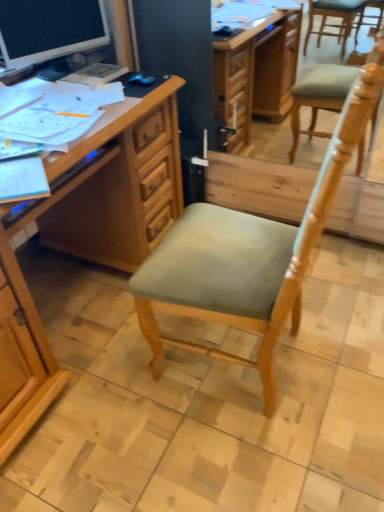
Where is `wooden desk at left`? wooden desk at left is located at coordinates (87, 233).

Locate an element on the screen. The height and width of the screenshot is (512, 384). light green fabric chair at center is located at coordinates (246, 257).

Identify the location of matte black monitor at upper left. (49, 29).

Does wooden desk at left have a larger size compared to light green fabric chair at center?

Indeed, wooden desk at left has a larger size compared to light green fabric chair at center.

Is light green fabric chair at center located within wooden desk at left?

Definitely not — light green fabric chair at center is not inside wooden desk at left.

Considering the sizes of objects wooden desk at left and light green fabric chair at center in the image provided, who is wider, wooden desk at left or light green fabric chair at center?

wooden desk at left is wider.

Considering the points (26, 321) and (168, 341), which point is behind, point (26, 321) or point (168, 341)?

Positioned behind is point (168, 341).

Would you say matte black monitor at upper left is inside or outside wooden desk at left?

matte black monitor at upper left is not enclosed by wooden desk at left.

Would you say matte black monitor at upper left is a long distance from wooden desk at left?

Actually, matte black monitor at upper left and wooden desk at left are a little close together.

From the image's perspective, which is below, light green fabric chair at center or matte black monitor at upper left?

light green fabric chair at center is shown below in the image.

Is light green fabric chair at center positioned far away from matte black monitor at upper left?

Yes, light green fabric chair at center and matte black monitor at upper left are quite far apart.

Which is closer to the camera, (143,308) or (60,25)?

The point (143,308) is more forward.

Can you confirm if light green fabric chair at center is shorter than matte black monitor at upper left?

In fact, light green fabric chair at center may be taller than matte black monitor at upper left.

Is wooden desk at left situated inside matte black monitor at upper left or outside?

wooden desk at left exists outside the volume of matte black monitor at upper left.

Which is behind, wooden desk at left or matte black monitor at upper left?

matte black monitor at upper left is more distant.

Considering the relative sizes of wooden desk at left and matte black monitor at upper left in the image provided, is wooden desk at left thinner than matte black monitor at upper left?

No.

This screenshot has height=512, width=384. Identify the location of desk that is below the matte black monitor at upper left (from the image's perspective). (87, 233).

Is the depth of matte black monitor at upper left less than that of light green fabric chair at center?

No, it is not.

From the image's perspective, is matte black monitor at upper left above or below light green fabric chair at center?

From the image's perspective, matte black monitor at upper left appears above light green fabric chair at center.

Does matte black monitor at upper left have a lesser height compared to light green fabric chair at center?

Yes.

Would you say light green fabric chair at center is a long distance from wooden desk at left?

No, light green fabric chair at center is not far from wooden desk at left.

Which is more to the left, light green fabric chair at center or wooden desk at left?

wooden desk at left is more to the left.

Relative to wooden desk at left, is light green fabric chair at center in front or behind?

Visually, light green fabric chair at center is located in front of wooden desk at left.

Consider the image. Who is shorter, light green fabric chair at center or wooden desk at left?

wooden desk at left.

Image resolution: width=384 pixels, height=512 pixels. I want to click on chair that is on the right side of wooden desk at left, so click(x=246, y=257).

Find the location of a particular element. The image size is (384, 512). desk below the matte black monitor at upper left (from the image's perspective) is located at coordinates (87, 233).

Estimate the real-world distances between objects in this image. Which object is closer to matte black monitor at upper left, wooden desk at left or light green fabric chair at center?

Among the two, wooden desk at left is located nearer to matte black monitor at upper left.

Considering their positions, is light green fabric chair at center positioned closer to wooden desk at left than matte black monitor at upper left?

light green fabric chair at center lies closer to wooden desk at left than the other object.

Estimate the real-world distances between objects in this image. Which object is further from light green fabric chair at center, wooden desk at left or matte black monitor at upper left?

matte black monitor at upper left is further to light green fabric chair at center.

Estimate the real-world distances between objects in this image. Which object is further from light green fabric chair at center, matte black monitor at upper left or wooden desk at left?

matte black monitor at upper left.

Looking at the image, which one is located further to wooden desk at left, matte black monitor at upper left or light green fabric chair at center?

matte black monitor at upper left lies further to wooden desk at left than the other object.

Estimate the real-world distances between objects in this image. Which object is closer to matte black monitor at upper left, light green fabric chair at center or wooden desk at left?

Among the two, wooden desk at left is located nearer to matte black monitor at upper left.

This screenshot has height=512, width=384. I want to click on desk between matte black monitor at upper left and light green fabric chair at center from top to bottom, so (87, 233).